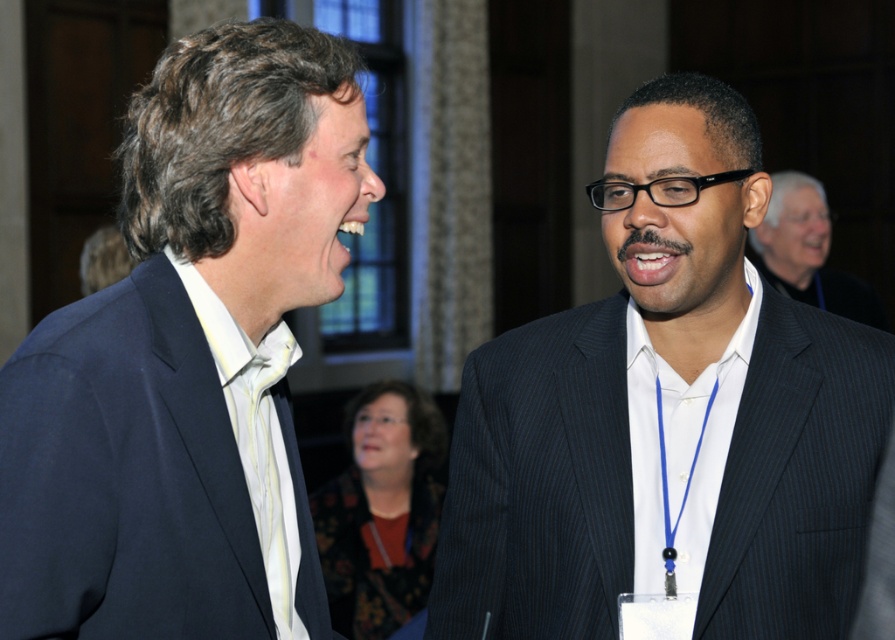
You are at a formal event and need to take a photo of the two people wearing the dark pinstripe suit at center and the black pinstripe suit at center. Which one should you focus on first if you want to capture both clearly in the frame?

The dark pinstripe suit at center is positioned under the black pinstripe suit at center, so you should focus on the black pinstripe suit at center first to ensure both are in clear view.

You are a photographer at the event and need to frame a photo of both the dark pinstripe suit at center and the black pinstripe suit at center. Which suit should you position closer to the edge of the frame to ensure both fit comfortably?

The dark pinstripe suit at center is wider than the black pinstripe suit at center, so positioning the wider dark pinstripe suit at center closer to the edge would allow both to fit within the frame more comfortably.